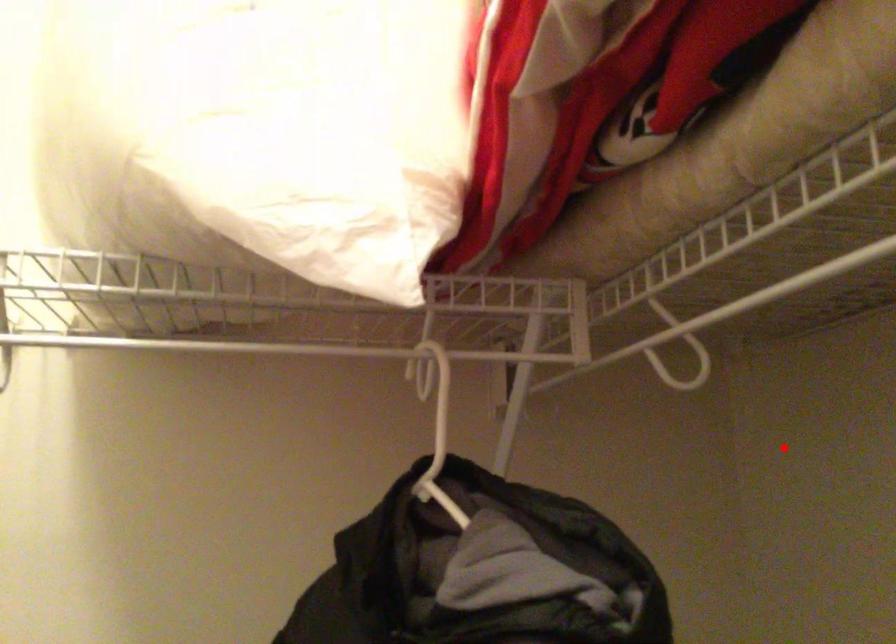
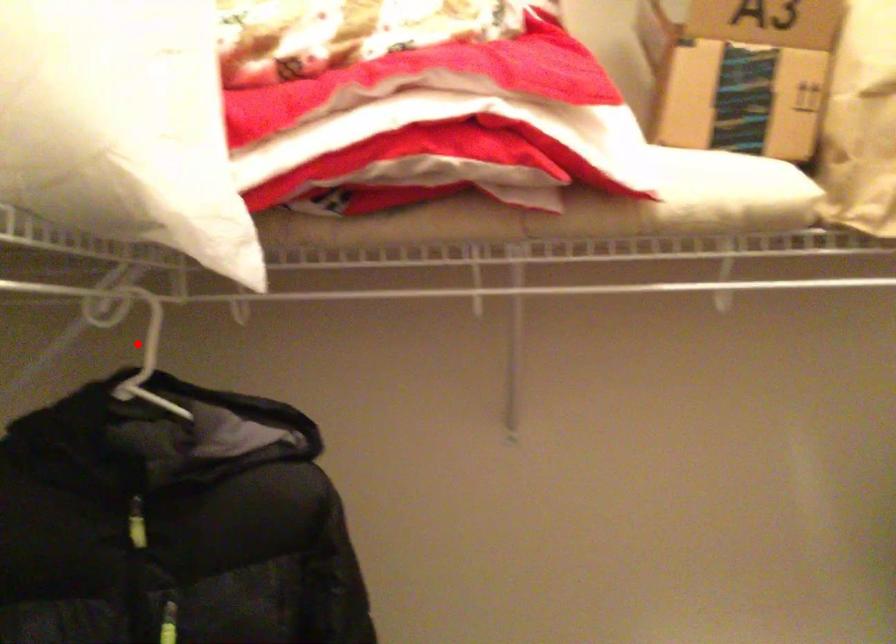
I am providing you with two images of the same scene from different viewpoints. A red point is marked on the first image and another point is marked on the second image. Do the highlighted points in image1 and image2 indicate the same real-world spot?

Yes